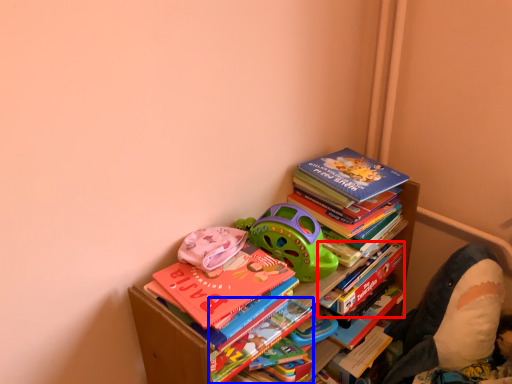
Question: Which object is closer to the camera taking this photo, paperback book (highlighted by a red box) or paperback book (highlighted by a blue box)?

Choices:
 (A) paperback book
 (B) paperback book

Answer: (B)